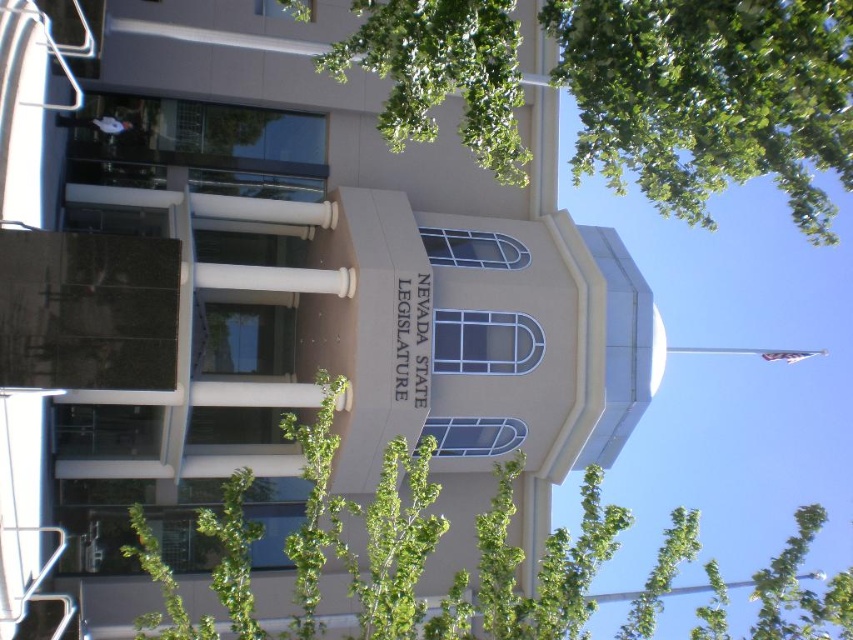
You are standing in front of the Nevada State Legislature building and notice a green leafy tree at upper center. Can you determine its exact position on the building facade using the coordinate system provided?

The green leafy tree at upper center is located at point coordinates [709,97].